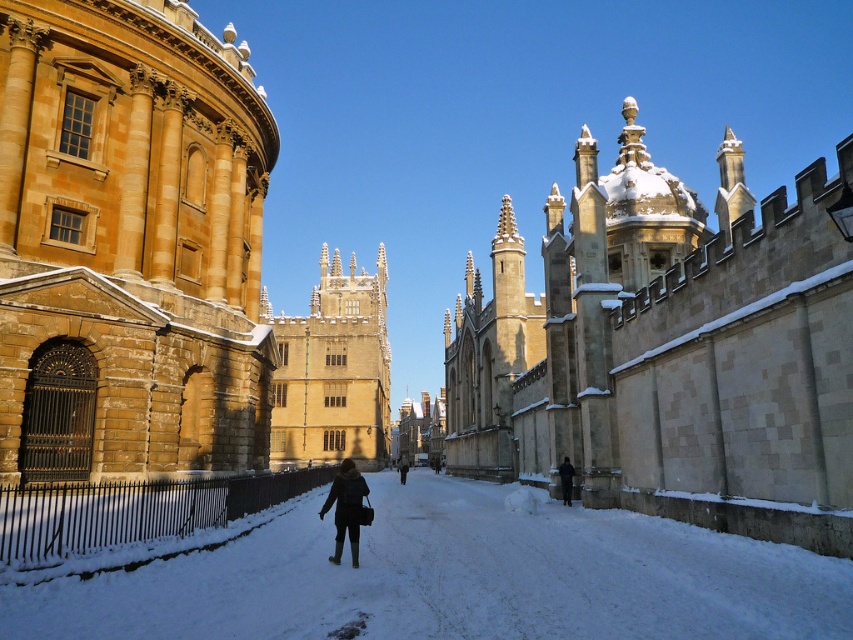
Question: Can you confirm if smooth stone wall at center is bigger than yellow stone building at center?

Choices:
 (A) no
 (B) yes

Answer: (A)

Question: Which object is the farthest from the dark brown coat at lower right?

Choices:
 (A) dark brown leather jacket at center
 (B) dark gray coat at center

Answer: (B)

Question: Is smooth stone wall at center bigger than dark gray coat at center?

Choices:
 (A) yes
 (B) no

Answer: (A)

Question: Does white powdery snow at center appear on the right side of yellow stone building at center?

Choices:
 (A) no
 (B) yes

Answer: (B)

Question: Considering the real-world distances, which object is farthest from the smooth stone wall at center?

Choices:
 (A) dark brown leather jacket at center
 (B) dark brown coat at lower right
 (C) dark gray coat at center
 (D) white powdery snow at center

Answer: (B)

Question: Which object appears closest to the camera in this image?

Choices:
 (A) smooth stone wall at center
 (B) yellow stone building at center
 (C) dark brown coat at lower right

Answer: (A)